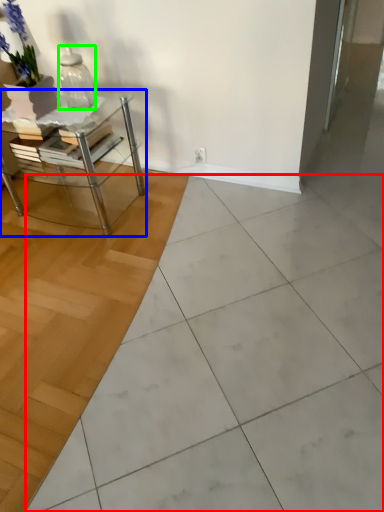
Question: Considering the real-world distances, which object is closest to ceramic tile (highlighted by a red box)? table (highlighted by a blue box) or vase (highlighted by a green box).

Choices:
 (A) table
 (B) vase

Answer: (A)